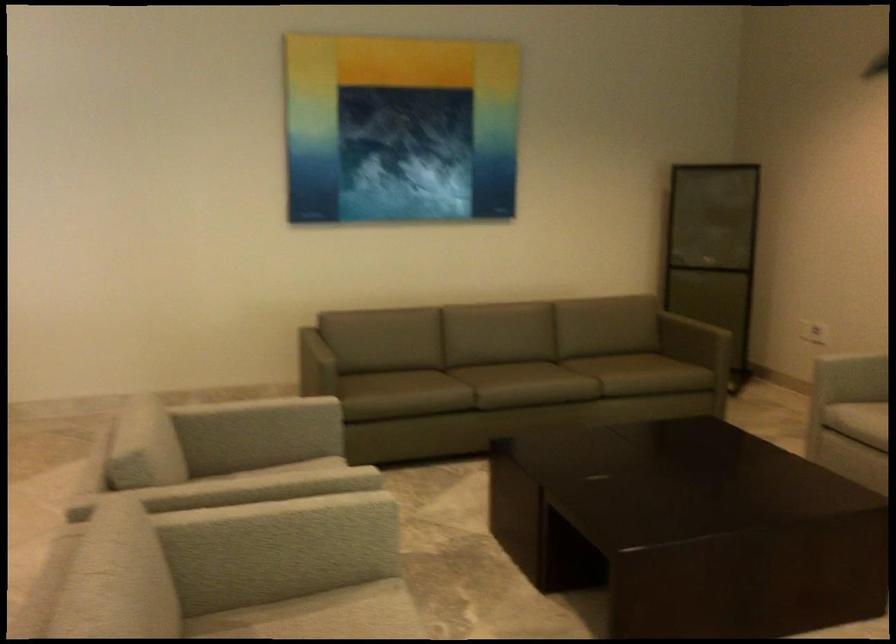
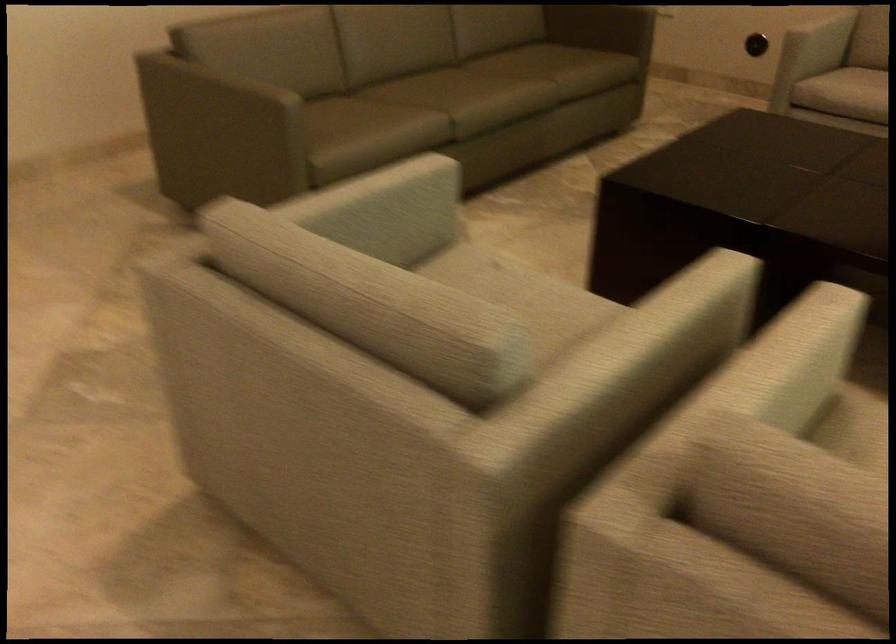
In the second image, find the point that corresponds to pixel 316 345 in the first image.

(231, 80)